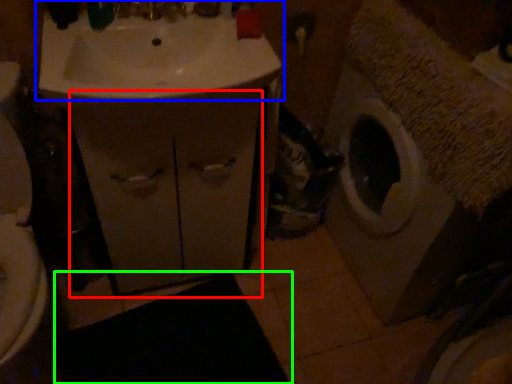
Question: Considering the real-world distances, which object is farthest from drawer (highlighted by a red box)? sink (highlighted by a blue box) or bath mat (highlighted by a green box)?

Choices:
 (A) sink
 (B) bath mat

Answer: (B)